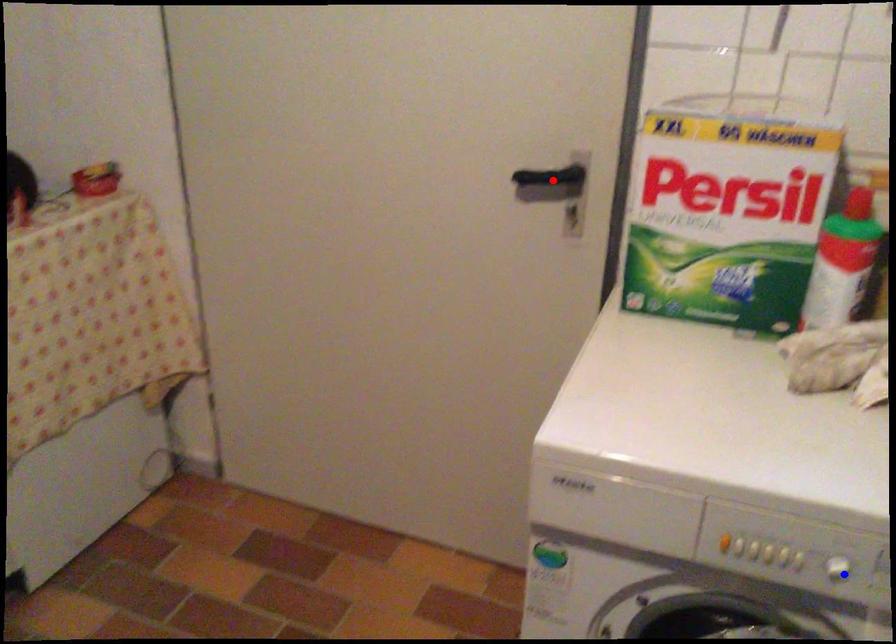
Question: Two points are marked on the image. Which point is closer to the camera?

Choices:
 (A) Blue point is closer.
 (B) Red point is closer.

Answer: (A)